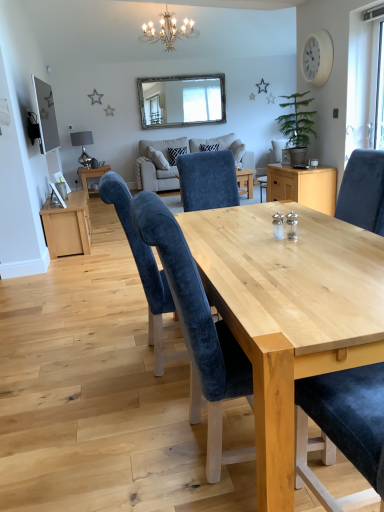
Question: Is green matte plant at right at the back of beige fabric couch at center?

Choices:
 (A) yes
 (B) no

Answer: (B)

Question: Is beige fabric couch at center wider than green matte plant at right?

Choices:
 (A) no
 (B) yes

Answer: (B)

Question: Is beige fabric couch at center smaller than green matte plant at right?

Choices:
 (A) no
 (B) yes

Answer: (A)

Question: From a real-world perspective, is beige fabric couch at center on green matte plant at right?

Choices:
 (A) no
 (B) yes

Answer: (A)

Question: Can you confirm if beige fabric couch at center is positioned to the right of green matte plant at right?

Choices:
 (A) no
 (B) yes

Answer: (A)

Question: Is beige fabric couch at center next to green matte plant at right and touching it?

Choices:
 (A) yes
 (B) no

Answer: (B)

Question: Considering the relative positions of white plastic clock at upper right and transparent glass window at upper right in the image provided, is white plastic clock at upper right to the left of transparent glass window at upper right from the viewer's perspective?

Choices:
 (A) no
 (B) yes

Answer: (B)

Question: Is white plastic clock at upper right positioned far away from transparent glass window at upper right?

Choices:
 (A) no
 (B) yes

Answer: (A)

Question: From the image's perspective, does white plastic clock at upper right appear higher than transparent glass window at upper right?

Choices:
 (A) yes
 (B) no

Answer: (A)

Question: Considering the relative sizes of white plastic clock at upper right and transparent glass window at upper right in the image provided, is white plastic clock at upper right smaller than transparent glass window at upper right?

Choices:
 (A) no
 (B) yes

Answer: (B)

Question: Is white plastic clock at upper right next to transparent glass window at upper right and touching it?

Choices:
 (A) no
 (B) yes

Answer: (A)

Question: Can transparent glass window at upper right be found inside white plastic clock at upper right?

Choices:
 (A) yes
 (B) no

Answer: (B)

Question: Considering the relative positions of wooden-framed mirror at upper center and velvet blue chair at center, the 2th chair viewed from the back, in the image provided, is wooden-framed mirror at upper center to the right of velvet blue chair at center, the 2th chair viewed from the back, from the viewer's perspective?

Choices:
 (A) yes
 (B) no

Answer: (B)